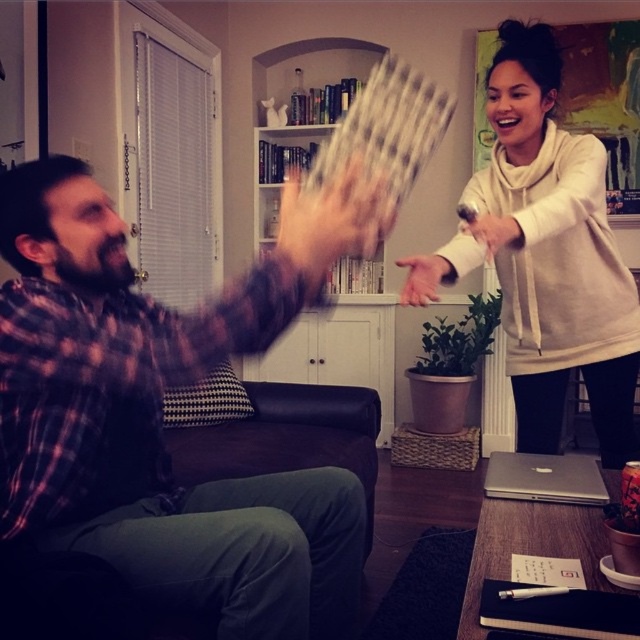
Question: Is plaid fabric shirt at left below white soft hoodie at upper right?

Choices:
 (A) yes
 (B) no

Answer: (A)

Question: Considering the relative positions of plaid fabric shirt at left and matte white hand at center in the image provided, where is plaid fabric shirt at left located with respect to matte white hand at center?

Choices:
 (A) right
 (B) left

Answer: (B)

Question: Does plaid fabric shirt at left appear on the left side of matte white hand at center?

Choices:
 (A) no
 (B) yes

Answer: (B)

Question: Considering the real-world distances, which object is closest to the matte white hand at center?

Choices:
 (A) plaid fabric shirt at left
 (B) white soft hoodie at upper right

Answer: (B)

Question: Which point appears closest to the camera in this image?

Choices:
 (A) pyautogui.click(x=483, y=218)
 (B) pyautogui.click(x=40, y=540)

Answer: (B)

Question: Which point appears farthest from the camera in this image?

Choices:
 (A) (554, 268)
 (B) (512, 241)
 (C) (259, 512)

Answer: (A)